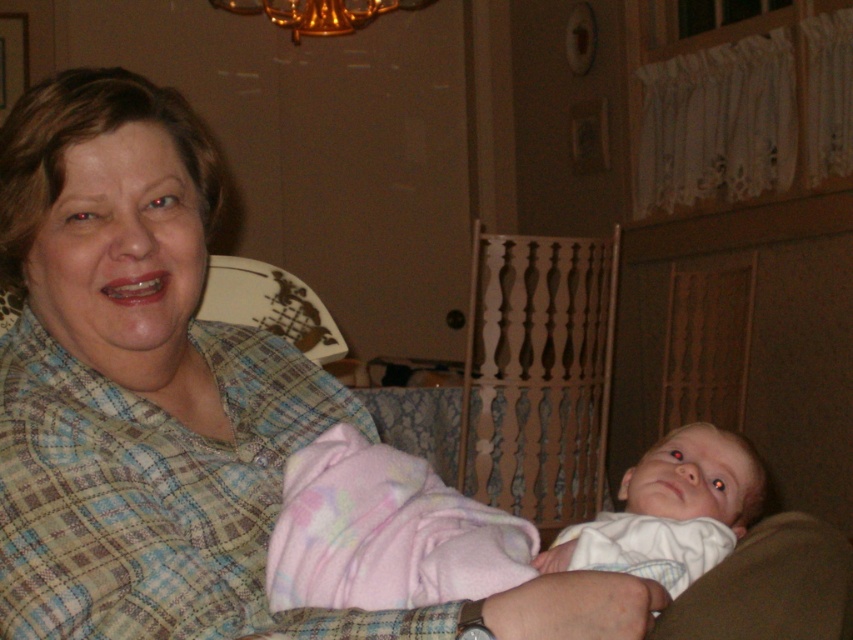
Question: Which point is closer to the camera?

Choices:
 (A) white cotton baby at center
 (B) plaid fabric at center

Answer: (B)

Question: Based on their relative distances, which object is farther from the plaid fabric at center?

Choices:
 (A) wooden at center
 (B) white cotton baby at center

Answer: (A)

Question: Which of the following is the farthest from the observer?

Choices:
 (A) plaid fabric at center
 (B) white cotton baby at center

Answer: (B)

Question: Is plaid fabric at center to the right of white cotton baby at center from the viewer's perspective?

Choices:
 (A) yes
 (B) no

Answer: (B)

Question: Is wooden at center positioned at the back of white cotton baby at center?

Choices:
 (A) yes
 (B) no

Answer: (A)

Question: Does plaid fabric at center appear under wooden at center?

Choices:
 (A) yes
 (B) no

Answer: (A)